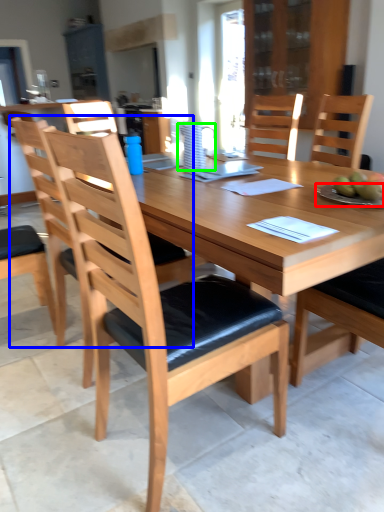
Question: Which is farther away from plate (highlighted by a red box)? chair (highlighted by a blue box) or pitcher (highlighted by a green box)?

Choices:
 (A) chair
 (B) pitcher

Answer: (A)